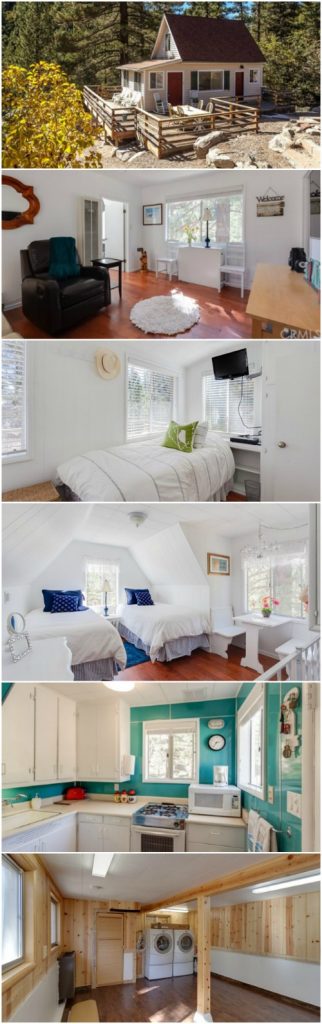
You are a GUI agent. You are given a task and a screenshot of the screen. Output one action in this format:
    pyautogui.click(x=<x>, y=<y>)
    Task: Click on the rooms
    The width and height of the screenshot is (322, 1024).
    Given the screenshot: What is the action you would take?
    pyautogui.click(x=158, y=248), pyautogui.click(x=163, y=427), pyautogui.click(x=163, y=548), pyautogui.click(x=165, y=732), pyautogui.click(x=162, y=935)